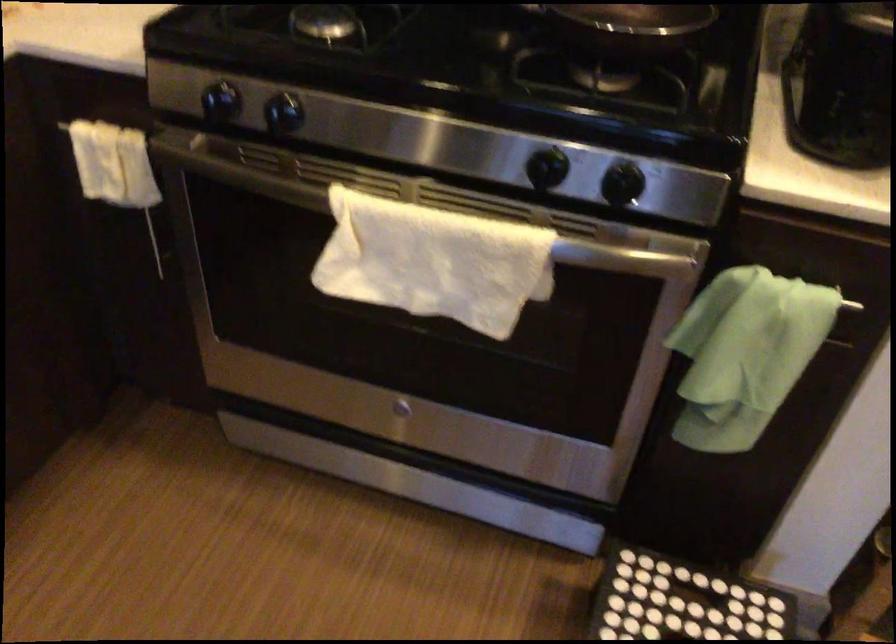
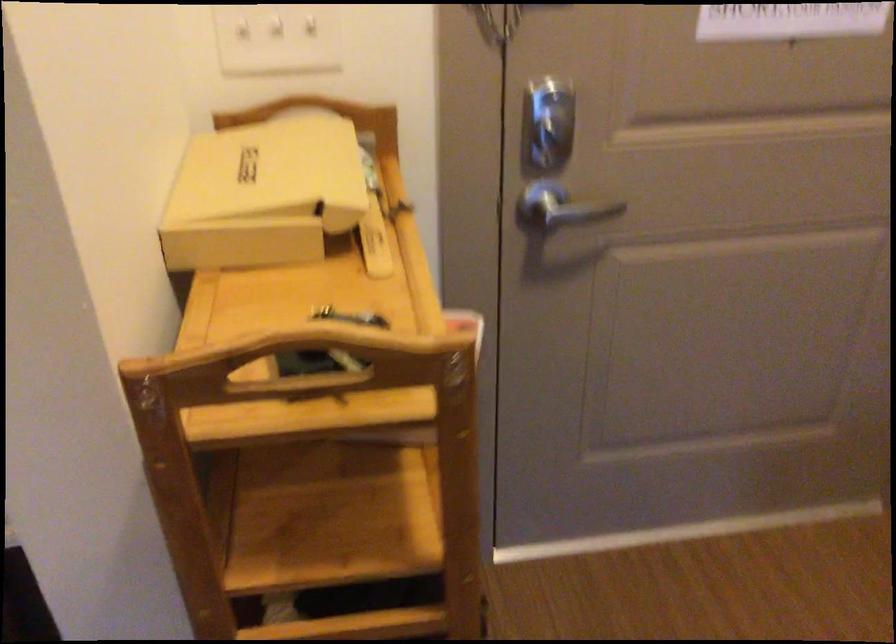
Question: The camera is either moving clockwise (left) or counter-clockwise (right) around the object. The first image is from the beginning of the video and the second image is from the end. Is the camera moving left or right when shooting the video?

Choices:
 (A) Left
 (B) Right

Answer: (A)